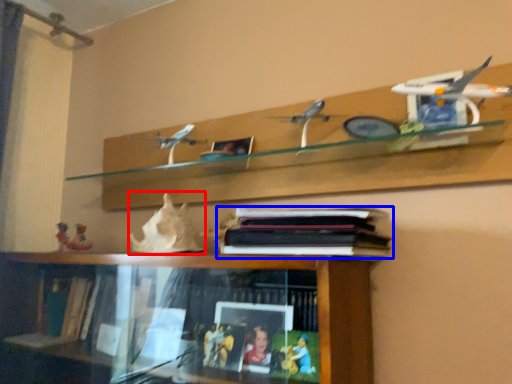
Question: Which object is further to the camera taking this photo, toy (highlighted by a red box) or book (highlighted by a blue box)?

Choices:
 (A) toy
 (B) book

Answer: (A)